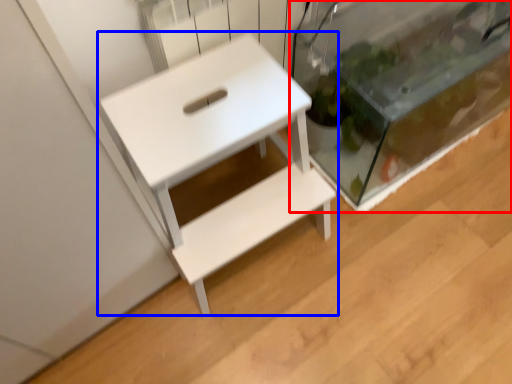
Question: Which of the following is the farthest to the observer, glass box (highlighted by a red box) or table (highlighted by a blue box)?

Choices:
 (A) glass box
 (B) table

Answer: (A)